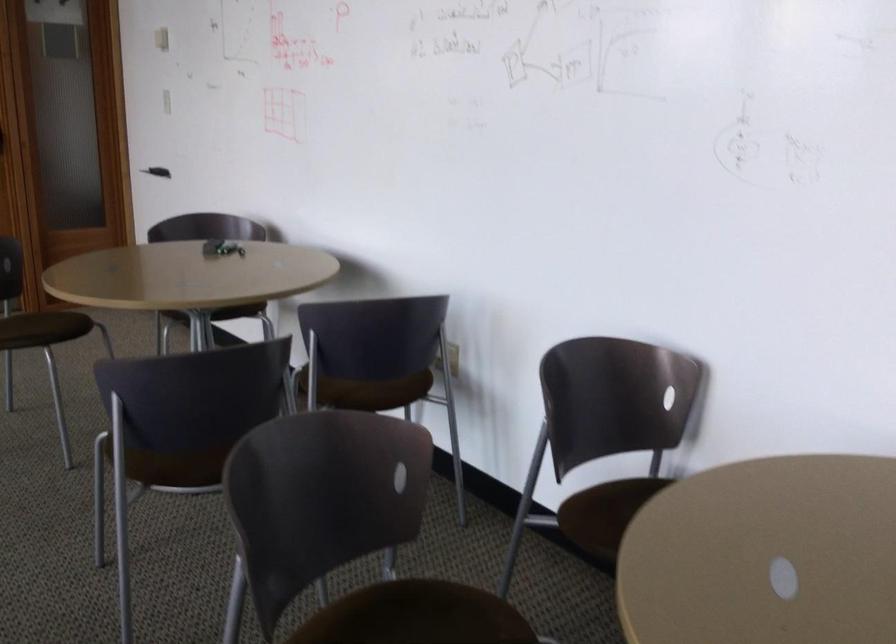
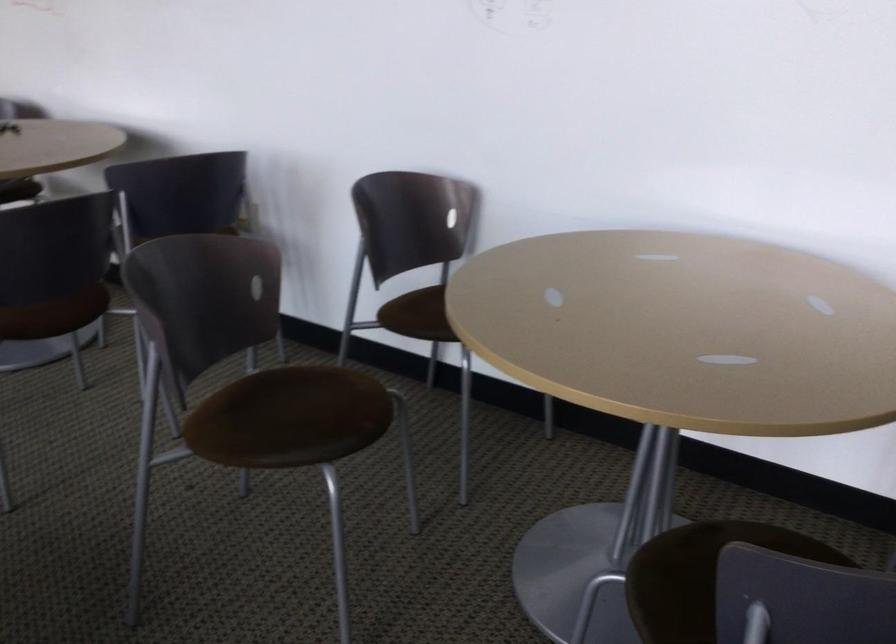
Question: The camera is either moving clockwise (left) or counter-clockwise (right) around the object. The first image is from the beginning of the video and the second image is from the end. Is the camera moving left or right when shooting the video?

Choices:
 (A) Left
 (B) Right

Answer: (A)